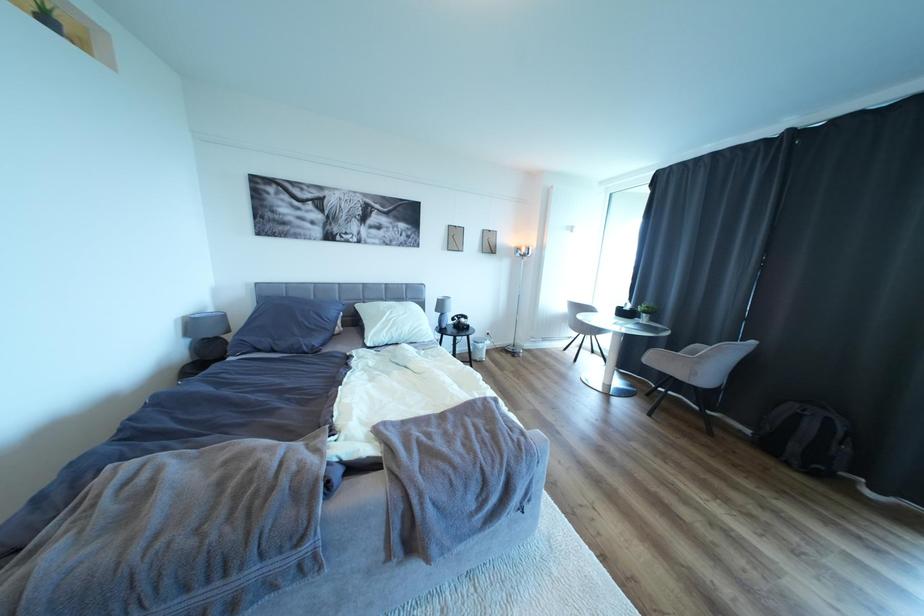
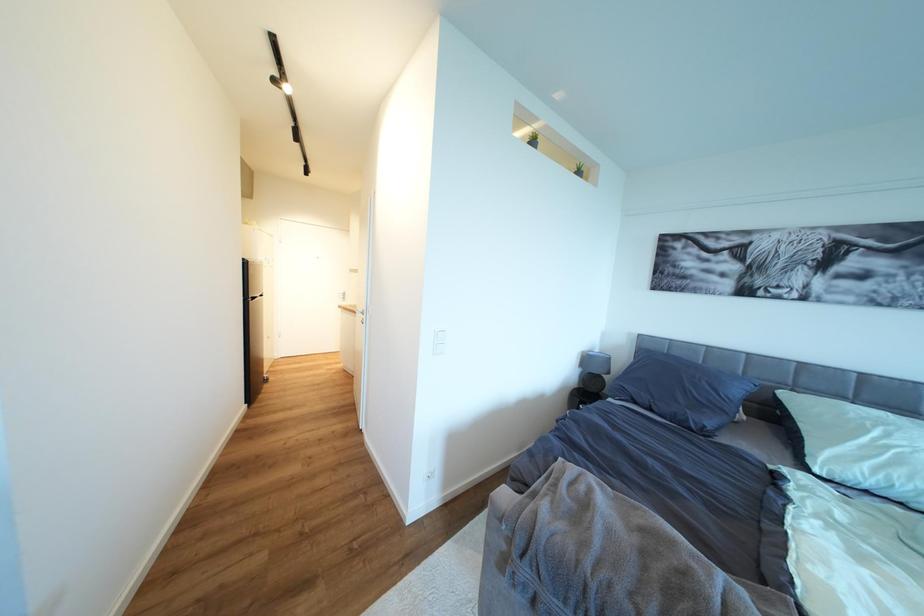
Question: The first image is from the beginning of the video and the second image is from the end. How did the camera likely rotate when shooting the video?

Choices:
 (A) Left
 (B) Right
 (C) Up
 (D) Down

Answer: (A)